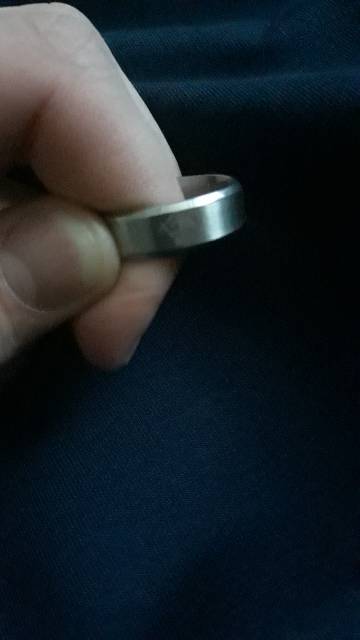
Identify the location of ripples in fabric. (237, 83), (230, 35).